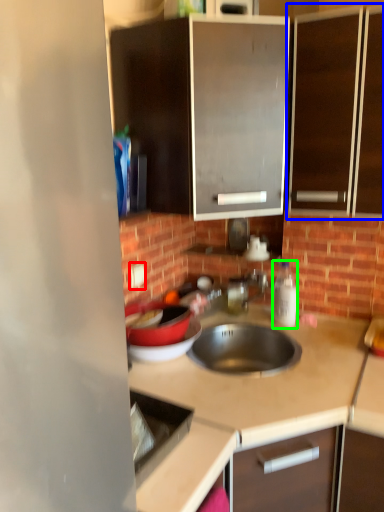
Question: Which object is the farthest from electric outlet (highlighted by a red box)? Choose among these: cabinetry (highlighted by a blue box) or bottle (highlighted by a green box).

Choices:
 (A) cabinetry
 (B) bottle

Answer: (A)